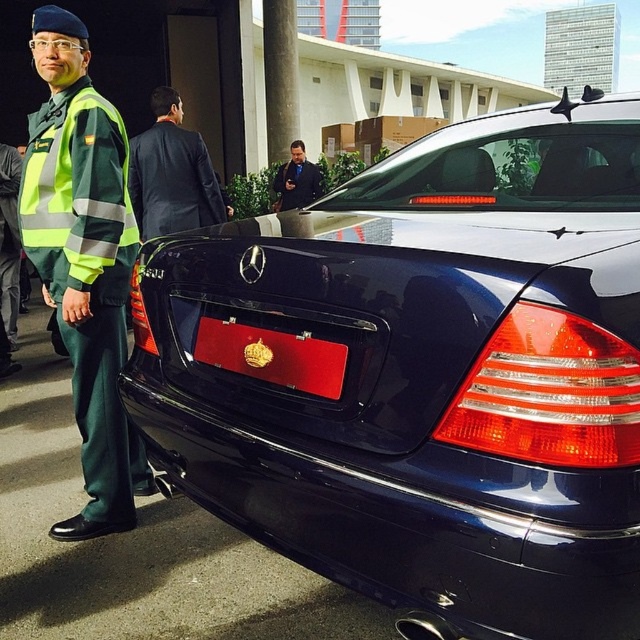
Question: Based on their relative distances, which object is farther from the green reflective fabric uniform at left?

Choices:
 (A) green reflective uniform at left
 (B) red leather license plate at center
 (C) dark blue suit at center

Answer: (B)

Question: Considering the relative positions of dark blue suit at center and red leather license plate at center in the image provided, where is dark blue suit at center located with respect to red leather license plate at center?

Choices:
 (A) right
 (B) left

Answer: (B)

Question: Among these points, which one is farthest from the camera?

Choices:
 (A) (144, 168)
 (B) (545, 166)
 (C) (250, 362)

Answer: (A)

Question: Which object is farther from the camera taking this photo?

Choices:
 (A) dark blue suit at center
 (B) green reflective uniform at left
 (C) green reflective fabric uniform at left
 (D) black fabric coat at center

Answer: (D)

Question: Is dark blue suit at center wider than green reflective fabric uniform at left?

Choices:
 (A) yes
 (B) no

Answer: (A)

Question: Does glossy black car at center appear over dark blue suit at center?

Choices:
 (A) no
 (B) yes

Answer: (A)